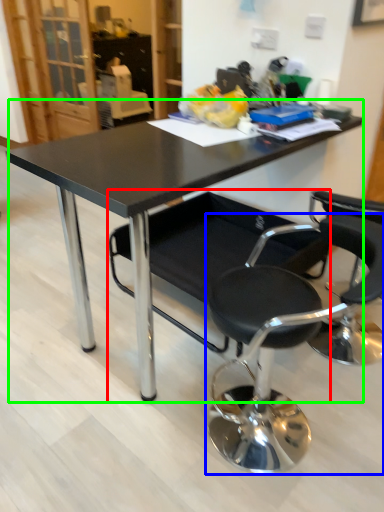
Question: Considering the real-world distances, which object is farthest from chair (highlighted by a red box)? chair (highlighted by a blue box) or table (highlighted by a green box)?

Choices:
 (A) chair
 (B) table

Answer: (B)